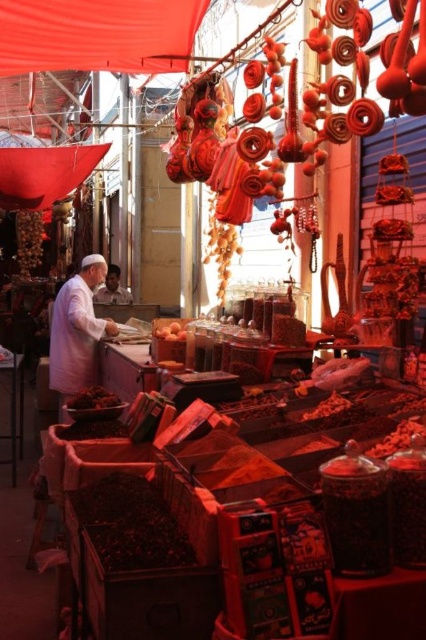
You are a customer at the market and want to place the dark brown matte dried fruit at lower left on top of the white cotton shirt at left. Will it fit without falling off?

The white cotton shirt at left has a greater height compared to the dark brown matte dried fruit at lower left, so placing the dried fruit on top should be stable and it won t fall off.

You are a customer in the market and want to pick up both the white cotton shirt at left and the dark brown matte dried fruit at lower left. Which item will you need to reach for first as you approach the market stall?

You will need to reach for the white cotton shirt at left first because it is closer to you than the dark brown matte dried fruit at lower left, which is positioned further away.